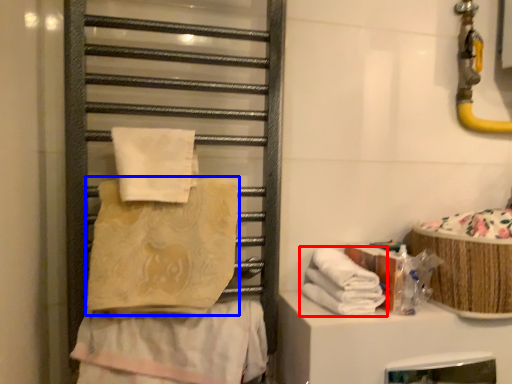
Question: Which object appears farthest to the camera in this image, towel (highlighted by a red box) or towel (highlighted by a blue box)?

Choices:
 (A) towel
 (B) towel

Answer: (A)